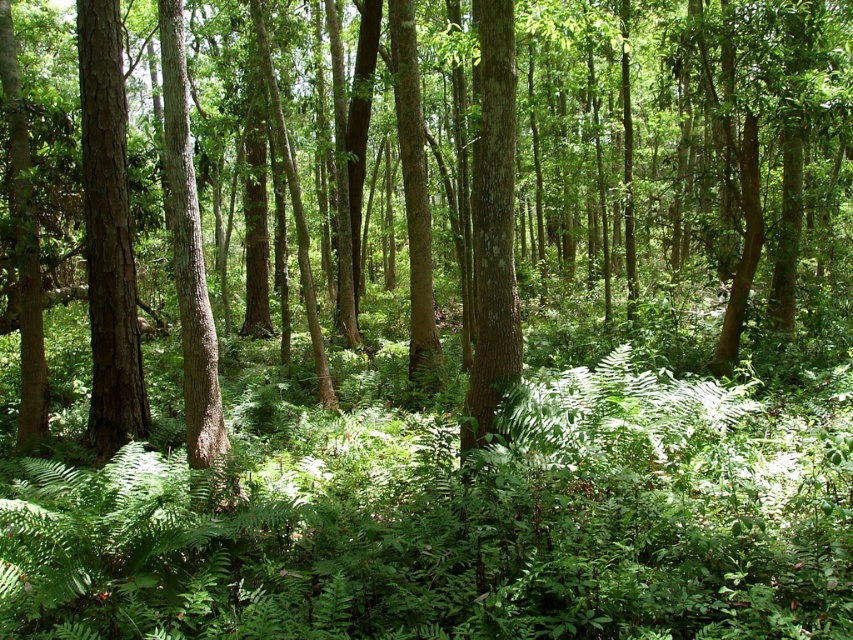
You are a hiker who wants to take a photo of the smooth brown tree trunk at left and the smooth brown tree trunk at center. Which tree trunk should you focus on first if you want to capture both in your camera frame?

The smooth brown tree trunk at left is above the smooth brown tree trunk at center, so you should focus on the smooth brown tree trunk at center first to ensure it is visible below the one at left.

You are navigating through the dense forest depicted in the image. You see two points marked as point (109, 387) and point (189, 440). Which point is closer to your current position?

Point (189, 440) is closer to your current position because it is in front of point (109, 387).